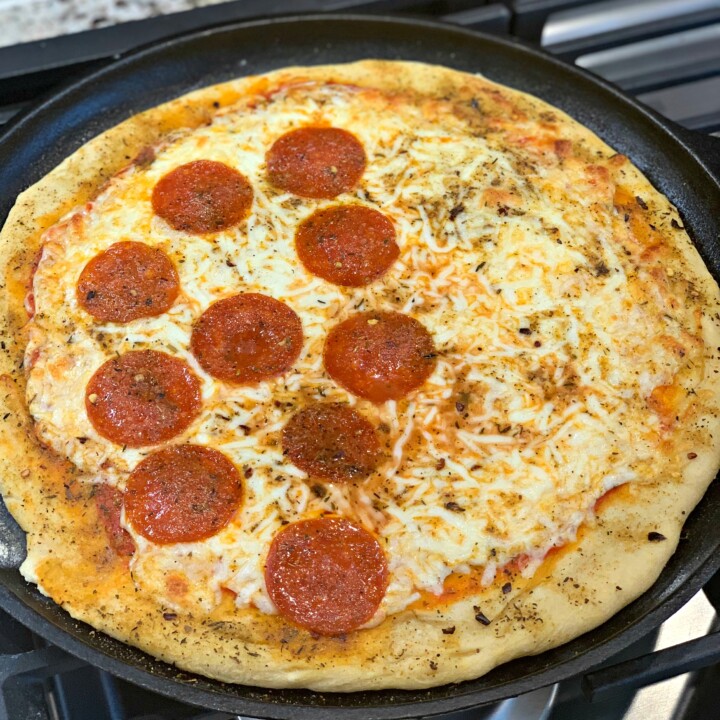
Identify the location of countertop. The height and width of the screenshot is (720, 720). (99, 6).